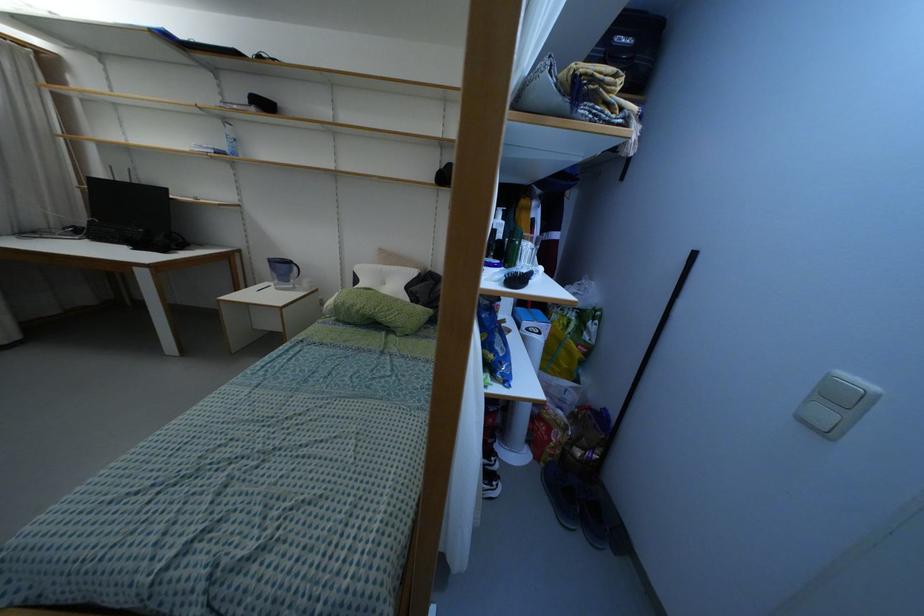
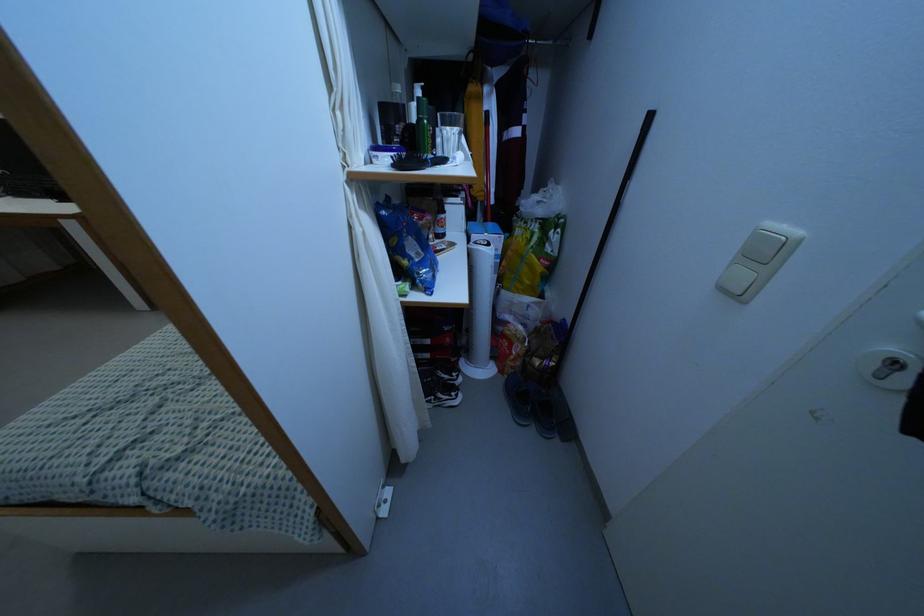
The point at (x=495, y=353) is marked in the first image. Where is the corresponding point in the second image?

(409, 257)